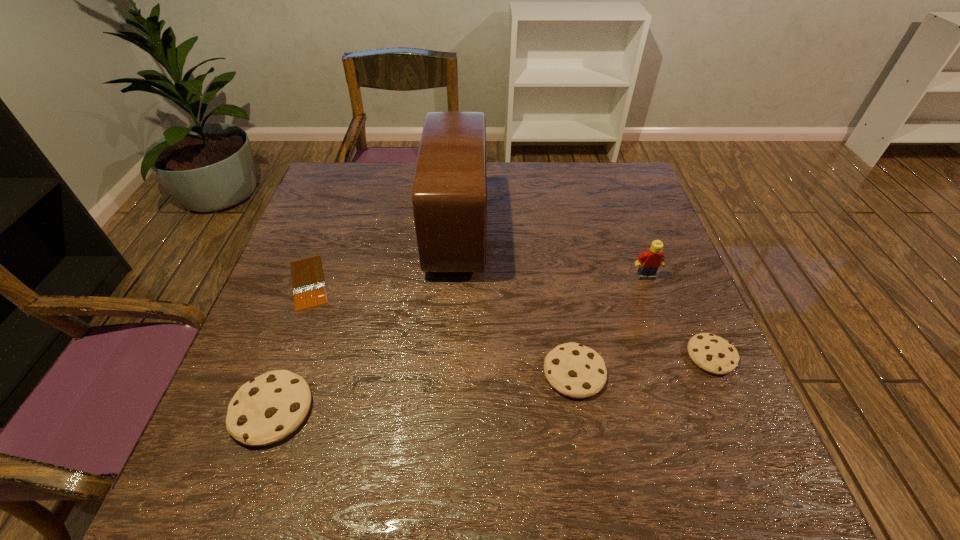
If equal spacing is desired by inserting an extra cookie among them, please point out a free spot for this new cookie. Please provide its 2D coordinates. Your answer should be formatted as a tuple, i.e. [(x, y)], where the tuple contains the x and y coordinates of a point satisfying the conditions above.

[(428, 390)]